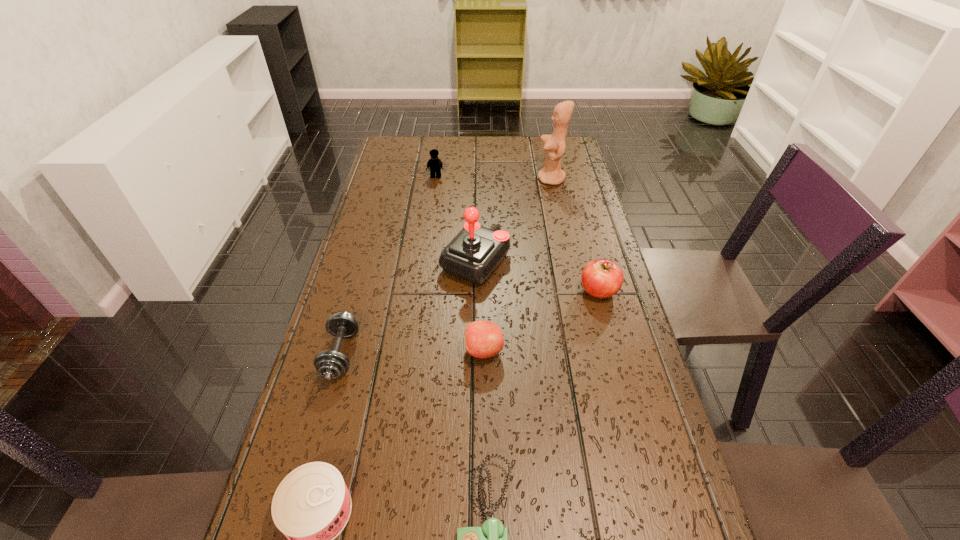
Locate an element on the screen. the tallest object is located at coordinates (554, 145).

Locate an element on the screen. The image size is (960, 540). the seventh shortest object is located at coordinates (476, 251).

You are a GUI agent. You are given a task and a screenshot of the screen. Output one action in this format:
    pyautogui.click(x=<x>, y=<y>)
    Task: Click on the Lego
    
    Given the screenshot: What is the action you would take?
    pyautogui.click(x=434, y=163)

You are a GUI agent. You are given a task and a screenshot of the screen. Output one action in this format:
    pyautogui.click(x=<x>, y=<y>)
    Task: Click on the taller apple
    This screenshot has height=540, width=960.
    Given the screenshot: What is the action you would take?
    pyautogui.click(x=601, y=278)

Find the location of a particular element. This screenshot has height=540, width=960. the right apple is located at coordinates (601, 278).

Identify the location of the left apple. (483, 339).

You are a GUI agent. You are given a task and a screenshot of the screen. Output one action in this format:
    pyautogui.click(x=<x>, y=<y>)
    Task: Click on the shorter apple
    This screenshot has height=540, width=960.
    Given the screenshot: What is the action you would take?
    pyautogui.click(x=483, y=339)

Find the location of a particular element. dumbbell is located at coordinates (329, 364).

At what (x,y) coordinates should I click in order to perform the action: click on vacant area situated 0.340m on the front-facing side of the tallest object. Please return your answer as a coordinate pair (x, y). Looking at the image, I should click on (442, 179).

The image size is (960, 540). I want to click on free space located 0.210m on the front-facing side of the tallest object, so click(x=478, y=179).